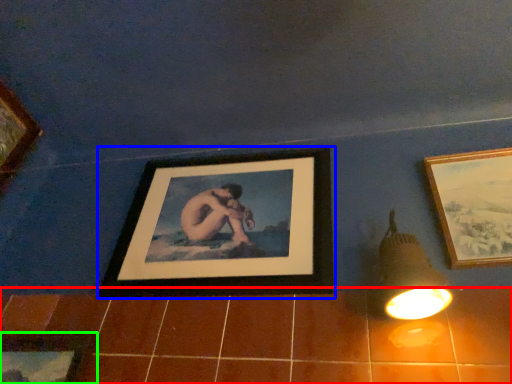
Question: Considering the real-world distances, which object is farthest from ceramic tile (highlighted by a red box)? picture frame (highlighted by a blue box) or picture frame (highlighted by a green box)?

Choices:
 (A) picture frame
 (B) picture frame

Answer: (B)